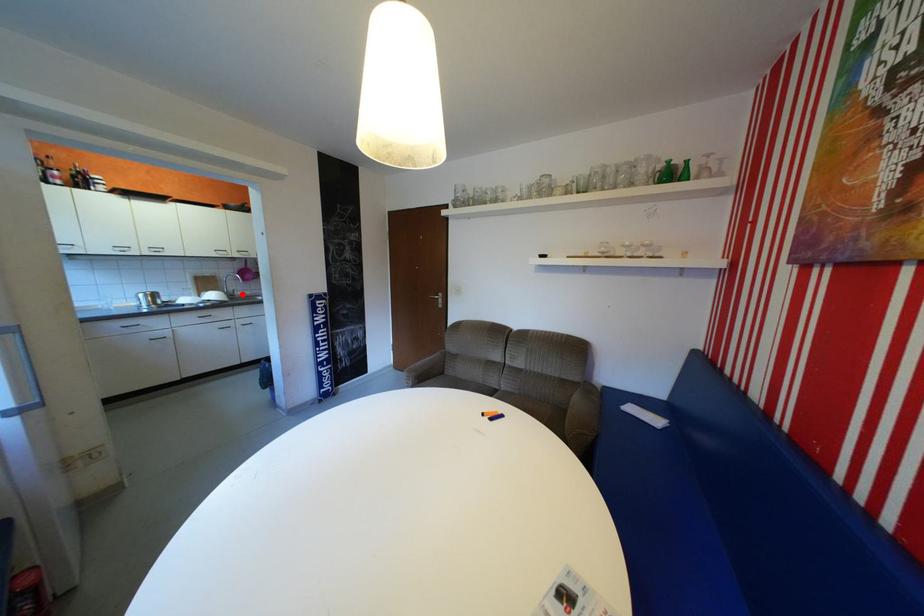
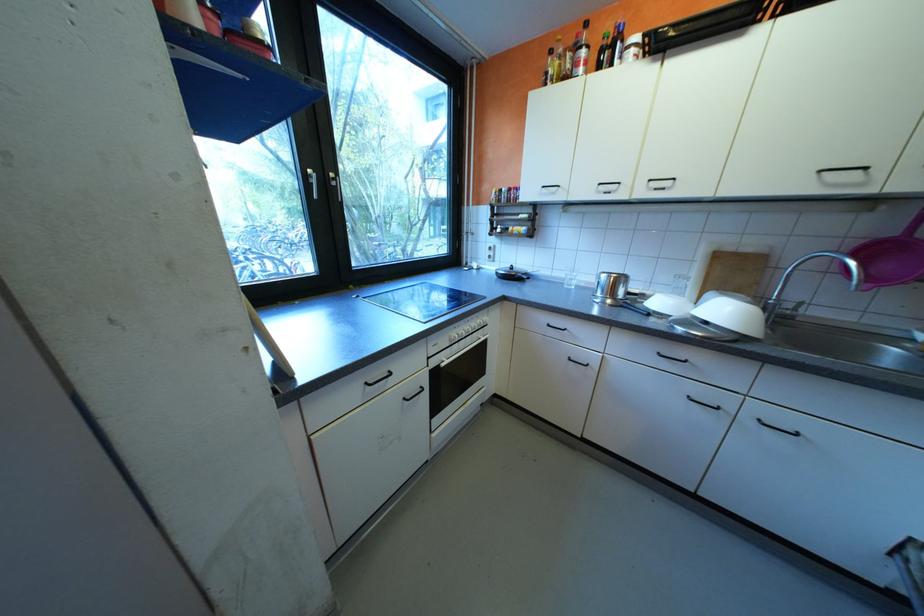
In the second image, find the point that corresponds to the highlighted location in the first image.

(791, 317)